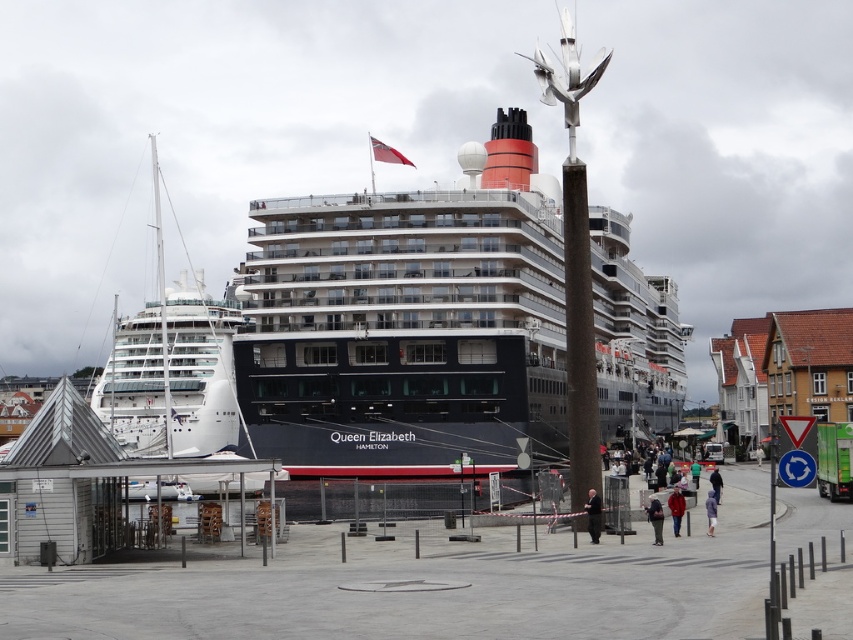
You are a photographer planning to take a photo of both the white glossy cruise ship at left and the dark gray suit at center. Which object should you focus on first if you want to ensure both are in sharp focus, considering their sizes?

The white glossy cruise ship at left is much taller than the dark gray suit at center, so focusing on the cruise ship first would help ensure both are in sharp focus as the suit is smaller and closer.

Looking at this image, you are a photographer trying to capture both the white glossy cruise ship at left and the dark green pants at center in a single photo. Since you want the cruise ship to appear larger than the pants in the photo, which object should you position closer to the camera?

The white glossy cruise ship at left should be positioned closer to the camera because it has a greater height compared to the dark green pants at center, so placing it nearer will emphasize its size difference in the photo.